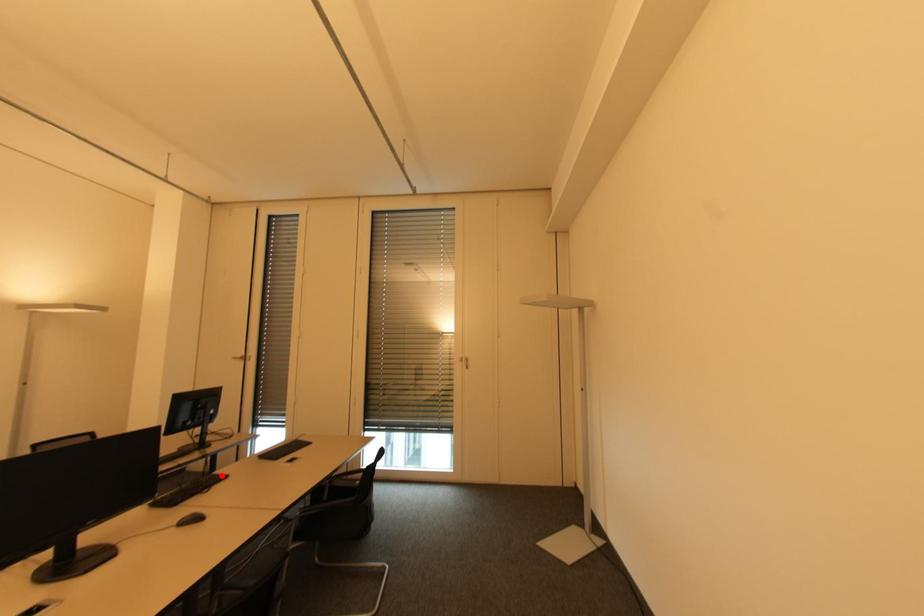
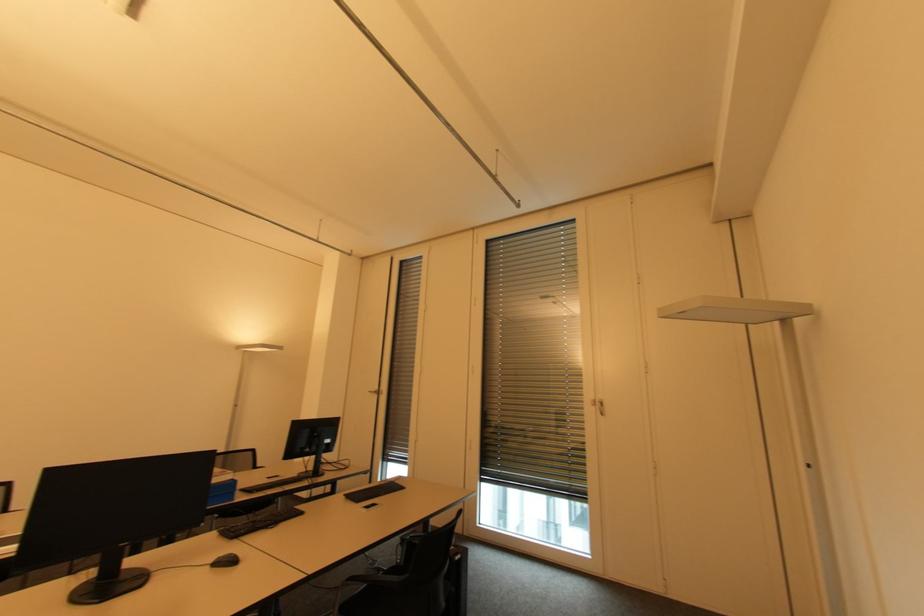
Question: A red point is marked in image1. In image2, is the corresponding 3D point closer to the camera or farther? Reply with the corresponding letter.

Choices:
 (A) The corresponding 3D point is closer.
 (B) The corresponding 3D point is farther.

Answer: (A)